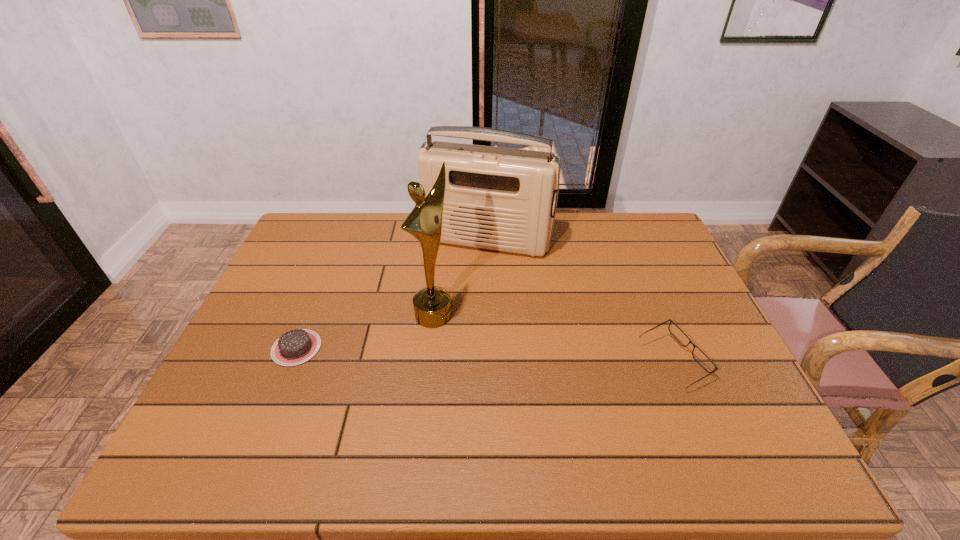
Where is `unoccupied position between the rightmost object and the leftmost object`? This screenshot has height=540, width=960. unoccupied position between the rightmost object and the leftmost object is located at coordinates (485, 355).

The height and width of the screenshot is (540, 960). I want to click on vacant point located between the shortest object and the award, so click(x=365, y=331).

At what (x,y) coordinates should I click in order to perform the action: click on empty space between the farthest object and the award. Please return your answer as a coordinate pair (x, y). Looking at the image, I should click on (461, 278).

What are the coordinates of `free spot between the award and the rightmost object` in the screenshot? It's located at (553, 338).

The image size is (960, 540). Identify the location of free spot between the farthest object and the award. (461, 278).

Find the location of a particular element. This screenshot has height=540, width=960. object that is the second closest one to the award is located at coordinates (294, 347).

Locate an element on the screen. This screenshot has width=960, height=540. the closest object to the chocolate cake is located at coordinates (432, 307).

This screenshot has height=540, width=960. In order to click on free spot that satisfies the following two spatial constraints: 1. on the front side of the rightmost object; 2. with the lenses facing outward on the farthest object in this screenshot , I will do pyautogui.click(x=490, y=362).

You are a GUI agent. You are given a task and a screenshot of the screen. Output one action in this format:
    pyautogui.click(x=<x>, y=<y>)
    Task: Click on the blank area in the image that satisfies the following two spatial constraints: 1. on the front side of the spectacles; 2. with the lenses facing outward on the chocolate cake
    The image size is (960, 540).
    Given the screenshot: What is the action you would take?
    pyautogui.click(x=291, y=362)

Where is `free space that satisfies the following two spatial constraints: 1. on the front side of the radio receiver; 2. with the lenses facing outward on the spectacles`? free space that satisfies the following two spatial constraints: 1. on the front side of the radio receiver; 2. with the lenses facing outward on the spectacles is located at coordinates (490, 362).